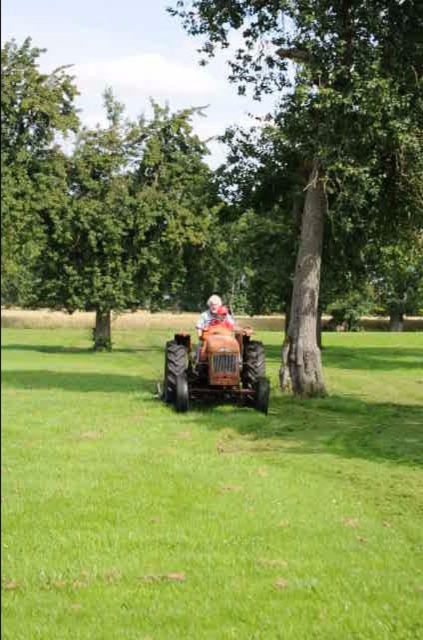
You are standing at the point marked as point (208, 499) in the image. What do you see around you?

A: You are standing on the green grassy field at center, which is the location of point (208, 499) in the image.

You are a gardener who needs to place a 10 meter long fence between the green leafy tree at upper left and the smooth bark tree at center. Can you fit the fence between them?

The distance between the green leafy tree at upper left and the smooth bark tree at center is 9.03 meters. Since the fence is 10 meters long, it is slightly too long to fit between them.